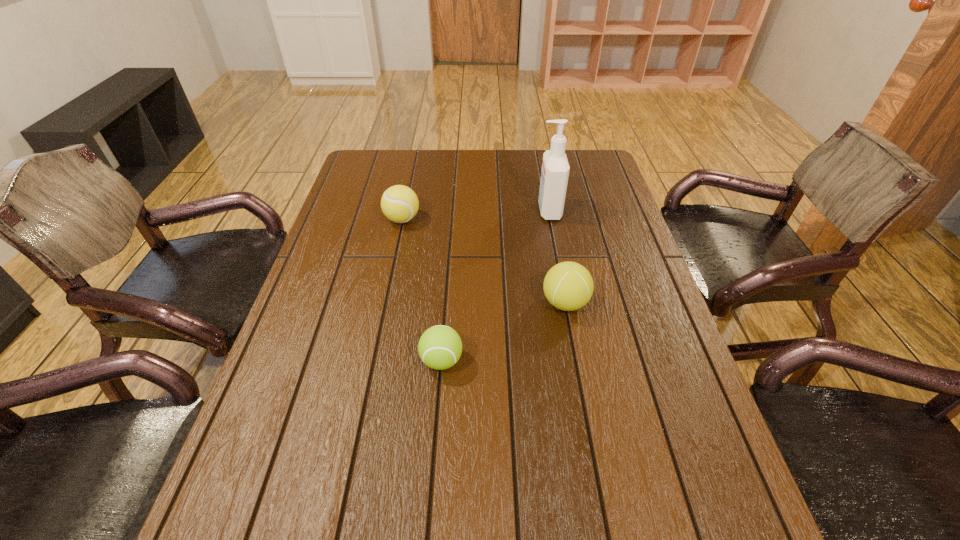
The width and height of the screenshot is (960, 540). In order to click on free space between the leftmost object and the rightmost tennis ball in this screenshot , I will do `click(484, 261)`.

Find the location of `vacant region between the leftmost tennis ball and the nearest tennis ball`. vacant region between the leftmost tennis ball and the nearest tennis ball is located at coordinates (421, 290).

Locate an element on the screen. free space that is in between the second nearest object and the nearest tennis ball is located at coordinates (503, 332).

This screenshot has width=960, height=540. I want to click on free space between the leftmost object and the second farthest tennis ball, so click(484, 261).

Where is `empty location between the farthest tennis ball and the tallest object`? The width and height of the screenshot is (960, 540). empty location between the farthest tennis ball and the tallest object is located at coordinates (475, 215).

Identify the location of free space between the farthest tennis ball and the cleansing agent. Image resolution: width=960 pixels, height=540 pixels. (475, 215).

Locate an element on the screen. Image resolution: width=960 pixels, height=540 pixels. free space between the farthest tennis ball and the cleansing agent is located at coordinates (475, 215).

Where is `object that is the second closest one to the rightmost tennis ball`? The image size is (960, 540). object that is the second closest one to the rightmost tennis ball is located at coordinates (555, 168).

I want to click on object that is the third nearest to the tallest object, so click(440, 347).

Where is `the closest tennis ball to the cleansing agent`? Image resolution: width=960 pixels, height=540 pixels. the closest tennis ball to the cleansing agent is located at coordinates (568, 286).